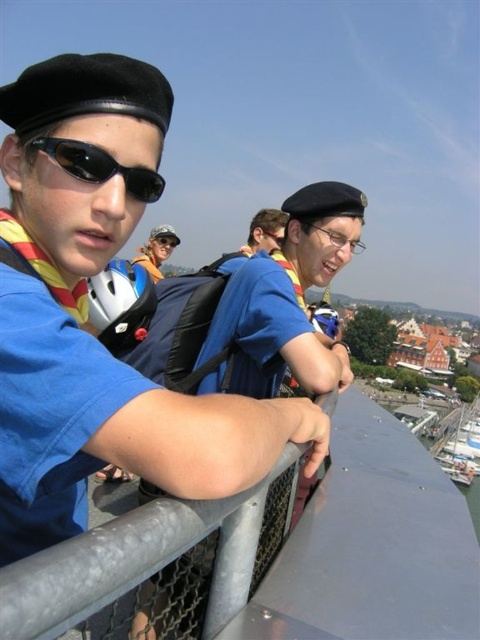
Question: Which object is positioned farthest from the matte blue shirt at center?

Choices:
 (A) brushed metal goggles at center
 (B) transparent plastic goggles at center
 (C) light blue shirt at center
 (D) black matte sunglasses at left

Answer: (B)

Question: Considering the real-world distances, which object is closest to the brushed metal goggles at center?

Choices:
 (A) black matte sunglasses at left
 (B) transparent plastic goggles at center
 (C) light blue shirt at center
 (D) white matte bicycle helmet at center

Answer: (C)

Question: Can you confirm if white matte bicycle helmet at center is smaller than matte blue shirt at center?

Choices:
 (A) no
 (B) yes

Answer: (B)

Question: Does black matte sunglasses at left have a greater width compared to matte blue shirt at center?

Choices:
 (A) yes
 (B) no

Answer: (A)

Question: Which of the following is the closest to the observer?

Choices:
 (A) (179, 243)
 (B) (131, 196)
 (C) (268, 241)
 (D) (151, 234)

Answer: (B)

Question: Is matte blue shirt at center to the right of light blue shirt at center from the viewer's perspective?

Choices:
 (A) yes
 (B) no

Answer: (A)